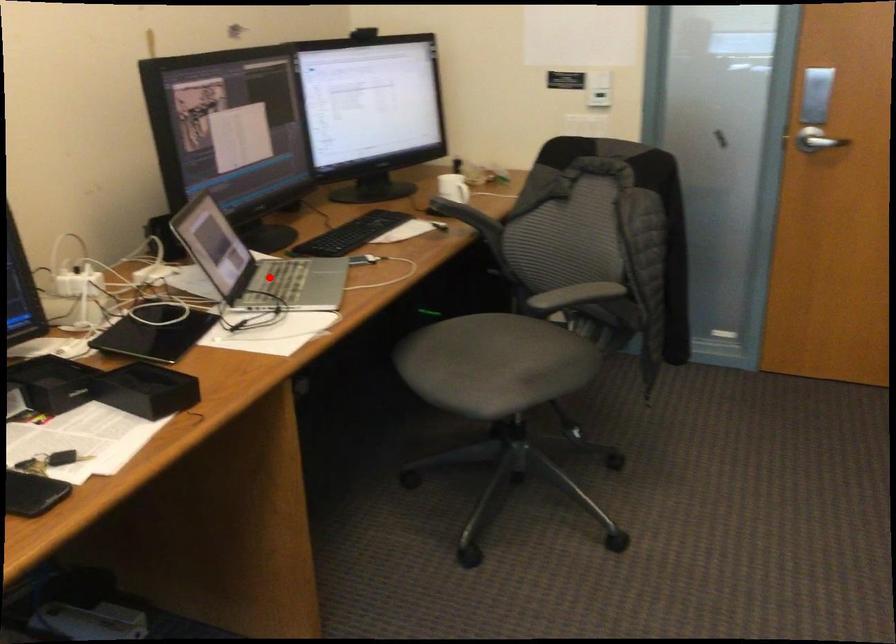
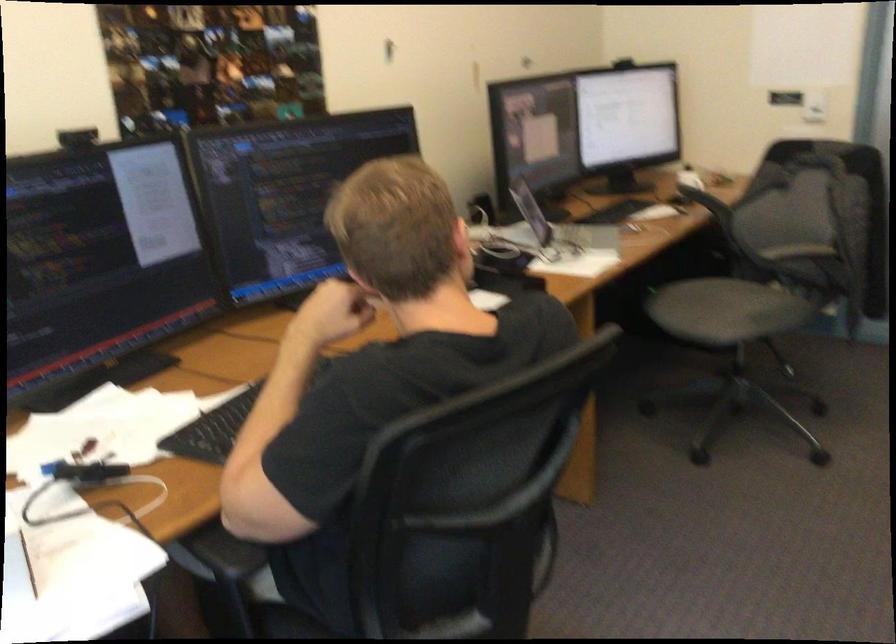
In the second image, find the point that corresponds to the highlighted location in the first image.

(561, 230)